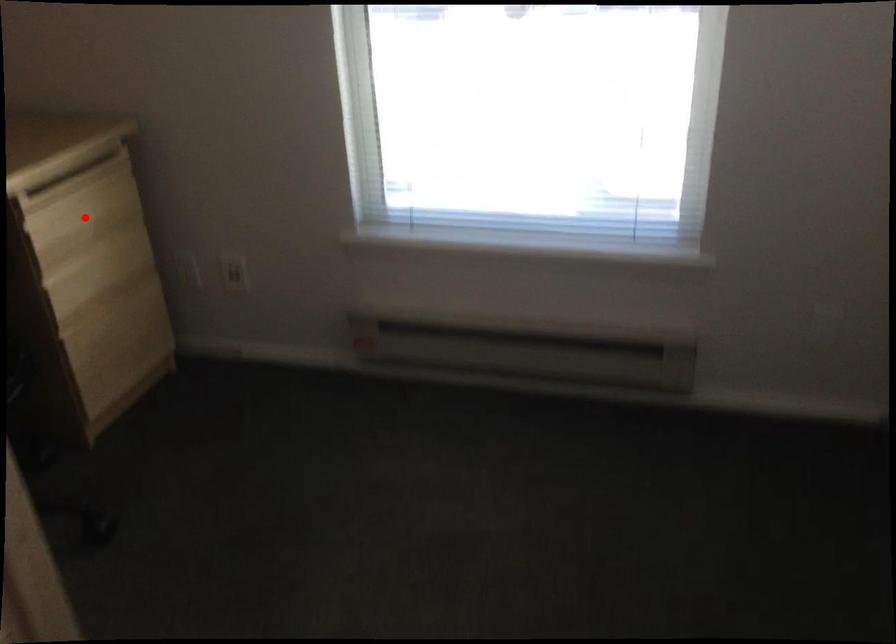
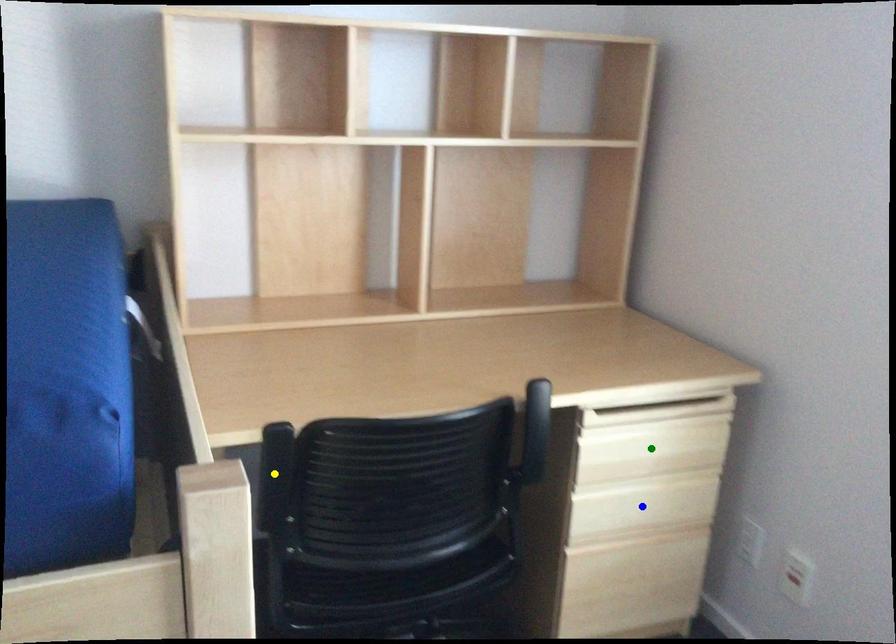
Question: I am providing you with two images of the same scene from different viewpoints. A red point is marked on the first image. You are given multiple points on the second image. Which mark in image 2 goes with the point in image 1?

Choices:
 (A) blue point
 (B) yellow point
 (C) green point

Answer: (C)